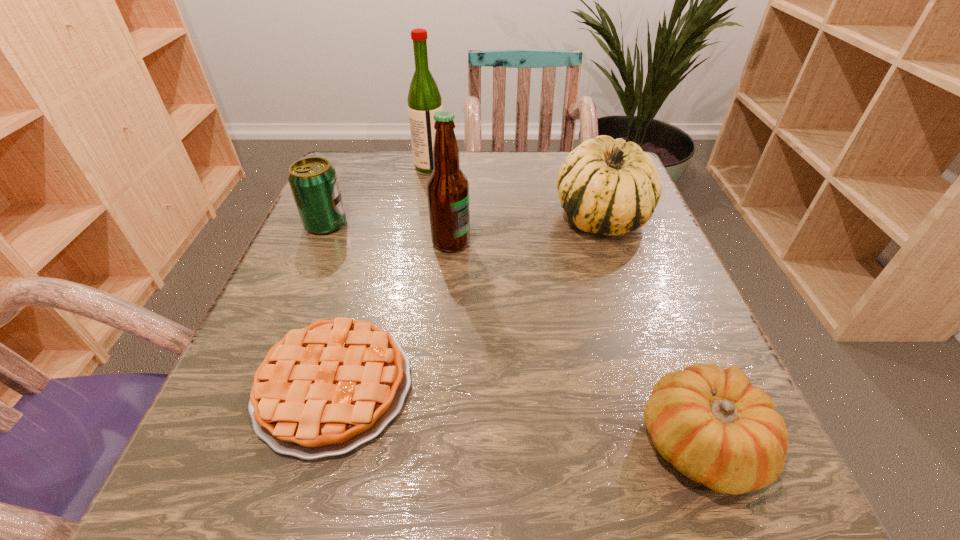
The width and height of the screenshot is (960, 540). Find the location of `pie located in the left edge section of the desktop`. pie located in the left edge section of the desktop is located at coordinates (323, 390).

You are a GUI agent. You are given a task and a screenshot of the screen. Output one action in this format:
    pyautogui.click(x=<x>, y=<y>)
    Task: Click on the object that is at the near left corner
    The height and width of the screenshot is (540, 960).
    Given the screenshot: What is the action you would take?
    pyautogui.click(x=323, y=390)

At what (x,y) coordinates should I click in order to perform the action: click on object located at the far right corner. Please return your answer as a coordinate pair (x, y). The width and height of the screenshot is (960, 540). Looking at the image, I should click on (607, 186).

The width and height of the screenshot is (960, 540). In order to click on object that is at the near right corner in this screenshot , I will do `click(715, 427)`.

Locate an element on the screen. The image size is (960, 540). vacant space at the far edge of the desktop is located at coordinates (548, 193).

In the image, there is a desktop. Where is `vacant region at the left edge`? The width and height of the screenshot is (960, 540). vacant region at the left edge is located at coordinates (318, 318).

Find the location of a particular element. This screenshot has height=540, width=960. free location at the right edge of the desktop is located at coordinates (595, 253).

What are the coordinates of `vacant space at the near left corner` in the screenshot? It's located at coord(252,477).

Find the location of a particular element. Image resolution: width=960 pixels, height=540 pixels. blank space at the far right corner is located at coordinates (565, 151).

The image size is (960, 540). In order to click on vacant region at the near right corner in this screenshot , I will do `click(731, 512)`.